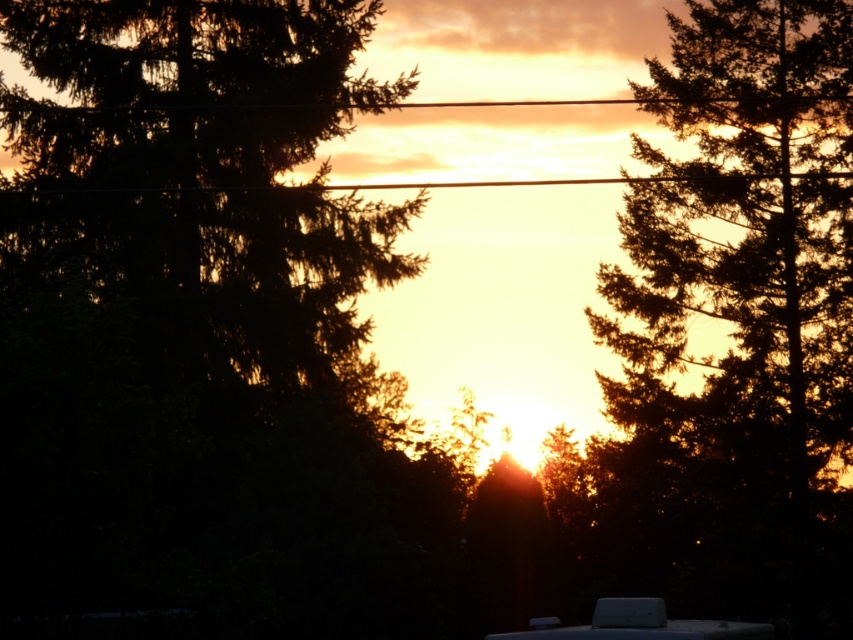
Looking at this image, can you confirm if dark green textured tree at right is bigger than white matte recreational vehicle at lower center?

Incorrect, dark green textured tree at right is not larger than white matte recreational vehicle at lower center.

You are a GUI agent. You are given a task and a screenshot of the screen. Output one action in this format:
    pyautogui.click(x=<x>, y=<y>)
    Task: Click on the dark green textured tree at right
    This screenshot has width=853, height=640.
    Given the screenshot: What is the action you would take?
    pyautogui.click(x=740, y=321)

Identify the location of dark green textured tree at right. (740, 321).